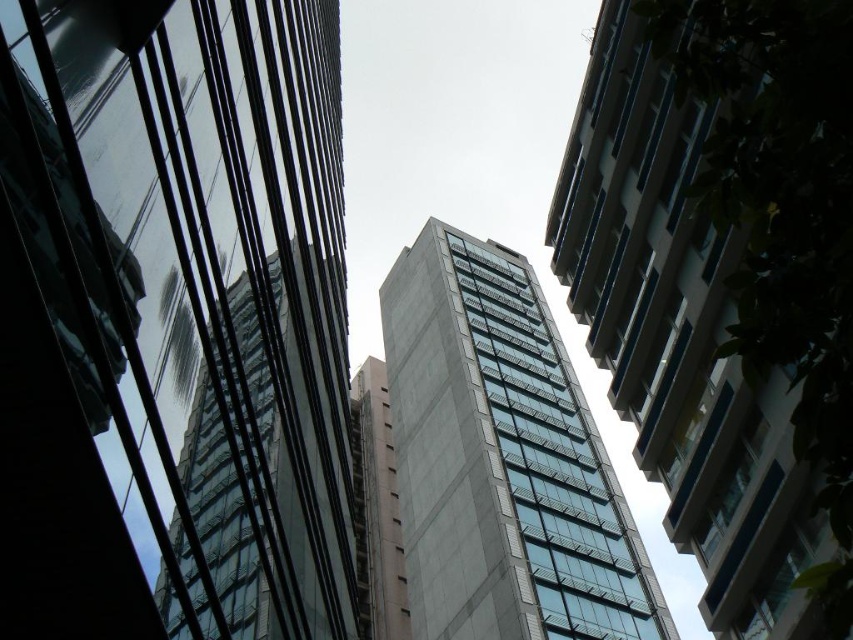
Can you confirm if glassy reflective building at center is bigger than transparent glass building at center?

Indeed, glassy reflective building at center has a larger size compared to transparent glass building at center.

Is glassy reflective building at center closer to the viewer compared to transparent glass building at center?

Yes, glassy reflective building at center is in front of transparent glass building at center.

Is point (329, 320) positioned in front of point (268, 424)?

No, (329, 320) is behind (268, 424).

Where is `glassy reflective building at center`? glassy reflective building at center is located at coordinates (172, 323).

Can you confirm if glassy blue building at center is positioned below transparent glass building at center?

No.

Based on the photo, which of these two, glassy blue building at center or transparent glass building at center, stands shorter?

Standing shorter between the two is transparent glass building at center.

At what (x,y) coordinates should I click in order to perform the action: click on glassy blue building at center. Please return your answer as a coordinate pair (x, y). This screenshot has width=853, height=640. Looking at the image, I should click on [680, 339].

You are a GUI agent. You are given a task and a screenshot of the screen. Output one action in this format:
    pyautogui.click(x=<x>, y=<y>)
    Task: Click on the glassy blue building at center
    
    Given the screenshot: What is the action you would take?
    pyautogui.click(x=680, y=339)

Is glassy reflective building at center taller than gray concrete building at center?

No, glassy reflective building at center is not taller than gray concrete building at center.

Does glassy reflective building at center have a greater width compared to gray concrete building at center?

No, glassy reflective building at center is not wider than gray concrete building at center.

This screenshot has width=853, height=640. What do you see at coordinates (172, 323) in the screenshot?
I see `glassy reflective building at center` at bounding box center [172, 323].

I want to click on glassy reflective building at center, so click(172, 323).